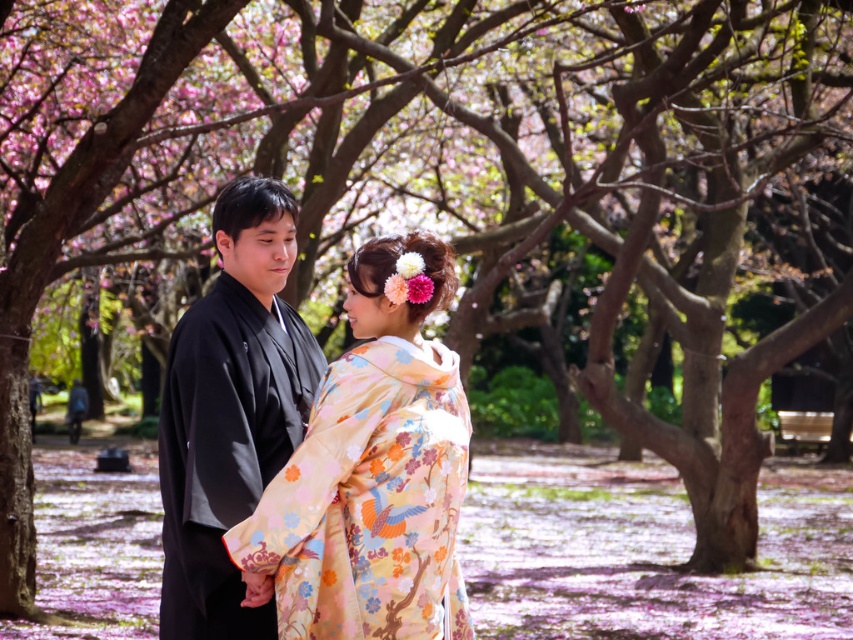
Consider the image. You are a photographer planning to take a portrait of both the floral silk kimono at center and the black silk kimono at center. Since you want to ensure both are clearly visible, which kimono should you focus on first to ensure proper framing?

The floral silk kimono at center has a smaller size compared to black silk kimono at center, so you should focus on framing the smaller floral silk kimono at center first to ensure it is properly captured in the shot.

You are standing in the park and want to take a photo of the two points in the scene. Which point, point (x=424, y=353) or point (x=291, y=381), is closer to you?

Point (x=424, y=353) is closer to the viewer than point (x=291, y=381).

You are a photographer standing at the camera position. You want to take a photo of the floral silk kimono at center. If your camera has a maximum focus range of 4 meters, will you be able to capture the kimono clearly?

The distance between the floral silk kimono at center and the camera is 4.43 meters, which exceeds the camera maximum focus range of 4 meters. Therefore, you cannot capture the kimono clearly.